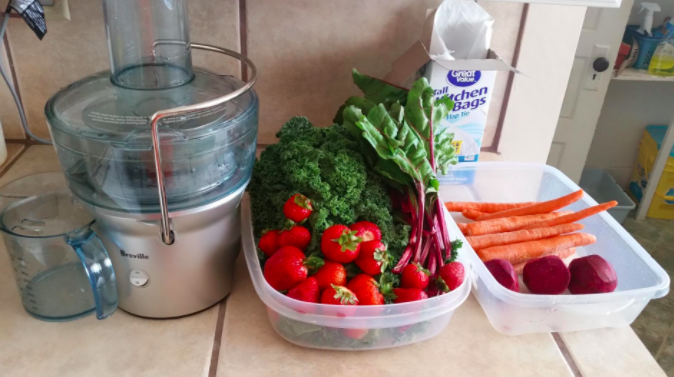
Where is `measuring cup`? This screenshot has width=674, height=377. measuring cup is located at coordinates (49, 245).